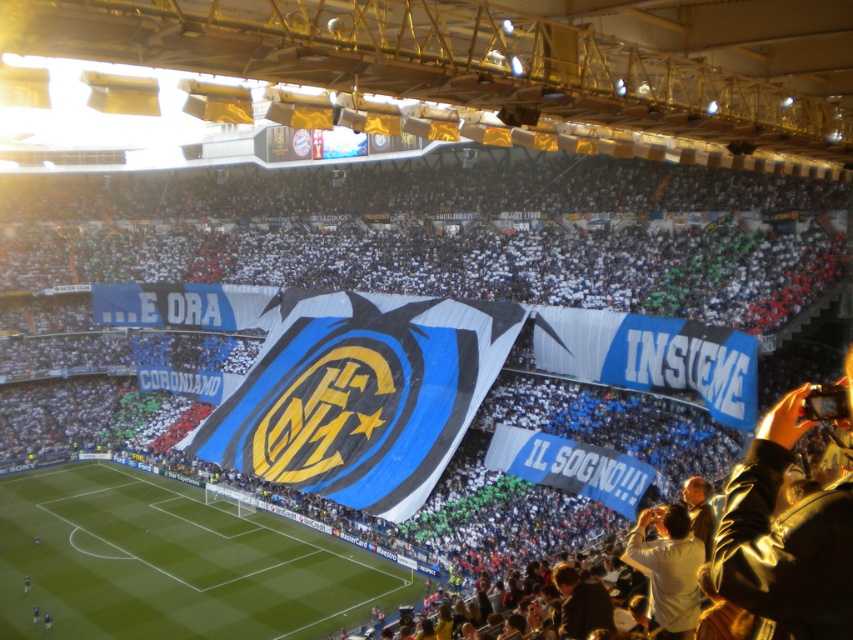
Question: Does green grass football field at center have a lesser width compared to white matte shirt at lower right?

Choices:
 (A) yes
 (B) no

Answer: (B)

Question: Which point is closer to the camera?

Choices:
 (A) green grass football field at center
 (B) white matte shirt at lower right

Answer: (B)

Question: Can you confirm if green grass football field at center is bigger than white matte shirt at lower right?

Choices:
 (A) yes
 (B) no

Answer: (A)

Question: Is green grass football field at center bigger than white matte shirt at lower right?

Choices:
 (A) yes
 (B) no

Answer: (A)

Question: Which of the following is the farthest from the observer?

Choices:
 (A) (264, 563)
 (B) (669, 609)

Answer: (A)